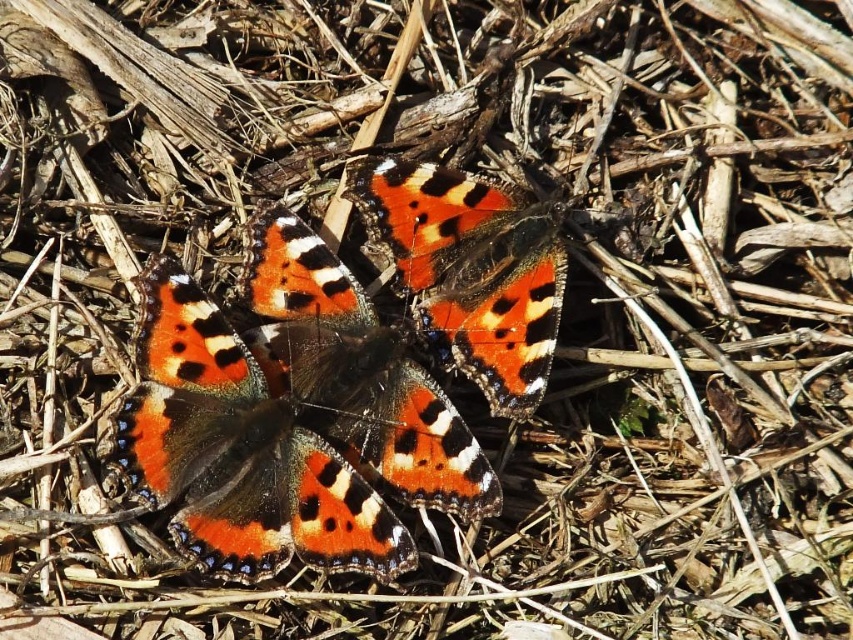
Can you confirm if orange-patterned wings at center is positioned to the right of orange-patterned wing at center?

No, orange-patterned wings at center is not to the right of orange-patterned wing at center.

Can you confirm if orange-patterned wings at center is bigger than orange-patterned wing at center?

Yes.

Does point (335, 545) lie behind point (409, 410)?

No.

Find the location of a particular element. orange-patterned wings at center is located at coordinates (238, 451).

Does orange-patterned wings at center have a larger size compared to shiny orange butterfly at center?

Yes.

Is orange-patterned wings at center closer to the viewer compared to shiny orange butterfly at center?

Yes, orange-patterned wings at center is in front of shiny orange butterfly at center.

What do you see at coordinates (238, 451) in the screenshot? The height and width of the screenshot is (640, 853). I see `orange-patterned wings at center` at bounding box center [238, 451].

This screenshot has width=853, height=640. What are the coordinates of `orange-patterned wings at center` in the screenshot? It's located at (238, 451).

Is point (299, 369) positioned after point (405, 237)?

No, it is in front of (405, 237).

Does orange-patterned wing at center have a greater height compared to shiny orange butterfly at center?

Yes, orange-patterned wing at center is taller than shiny orange butterfly at center.

Does point (396, 484) lie behind point (546, 269)?

That is False.

Image resolution: width=853 pixels, height=640 pixels. I want to click on orange-patterned wing at center, so click(357, 372).